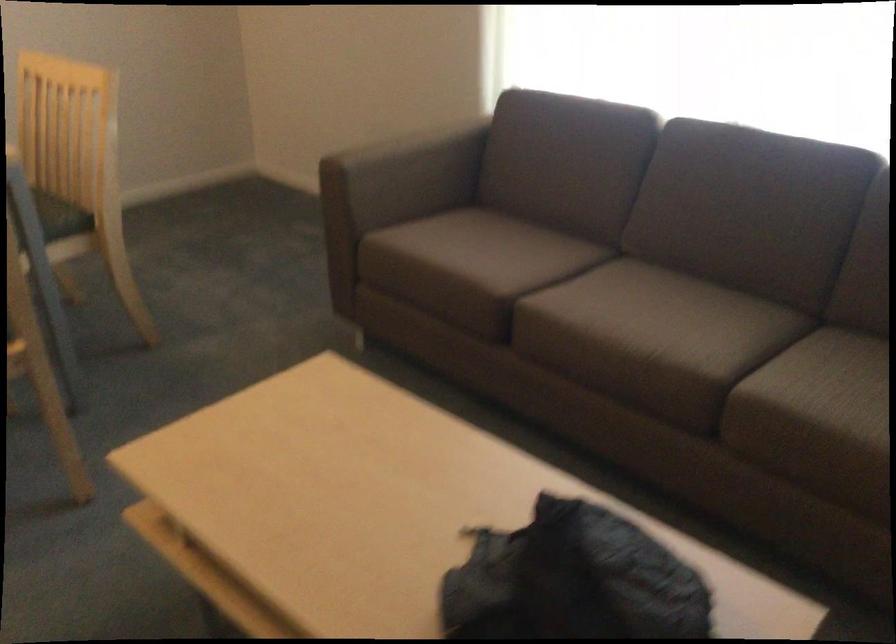
Find where to sit the chair sitting surface. Please return your answer as a coordinate pair (x, y).

(61, 216)